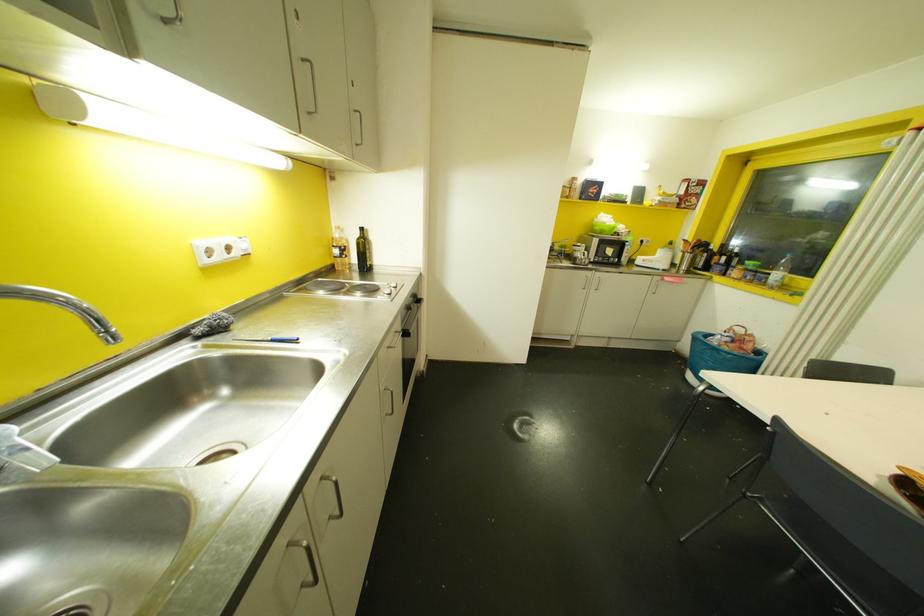
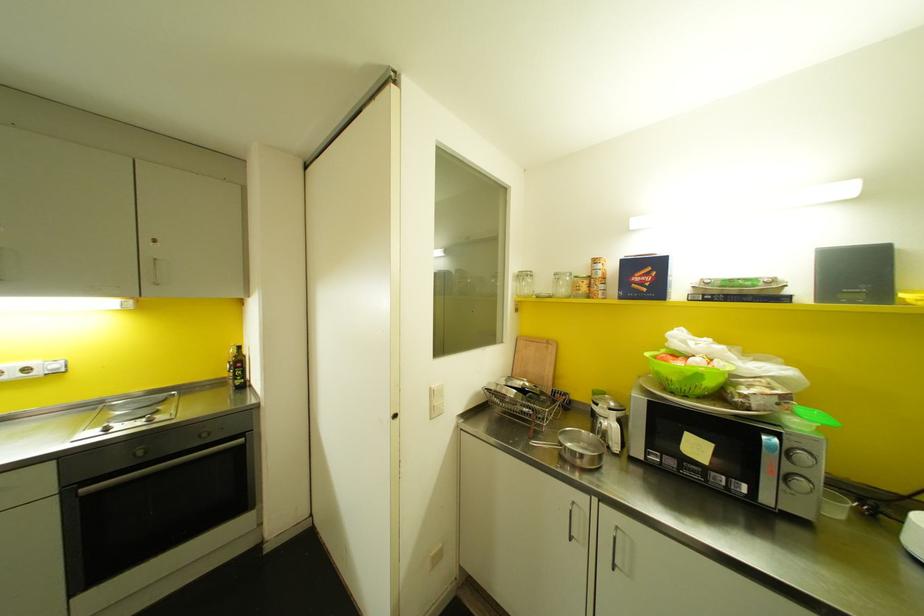
Where in the second image is the point corresponding to the point at 368,254 from the first image?

(237, 371)